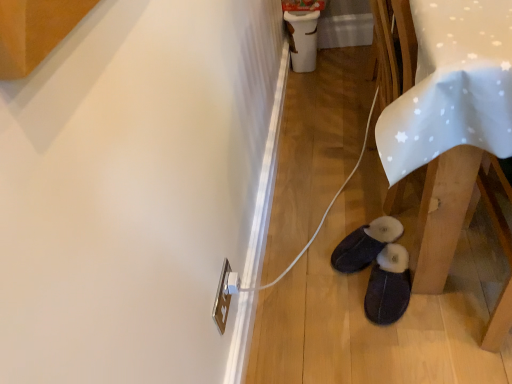
Where is `free space behind dark gray suede slippers at lower center, the 1th footwear when ordered from front to back`? This screenshot has height=384, width=512. free space behind dark gray suede slippers at lower center, the 1th footwear when ordered from front to back is located at coordinates (347, 228).